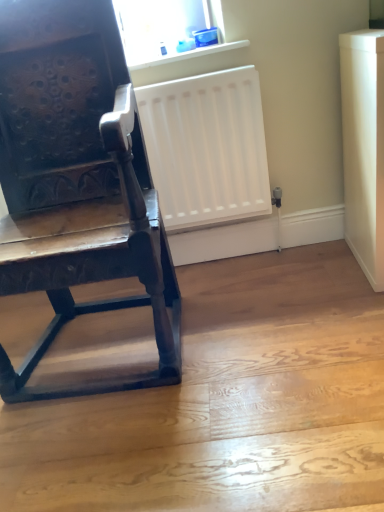
Find the location of `vacant space to the right of dark wood chair at left`. vacant space to the right of dark wood chair at left is located at coordinates (272, 322).